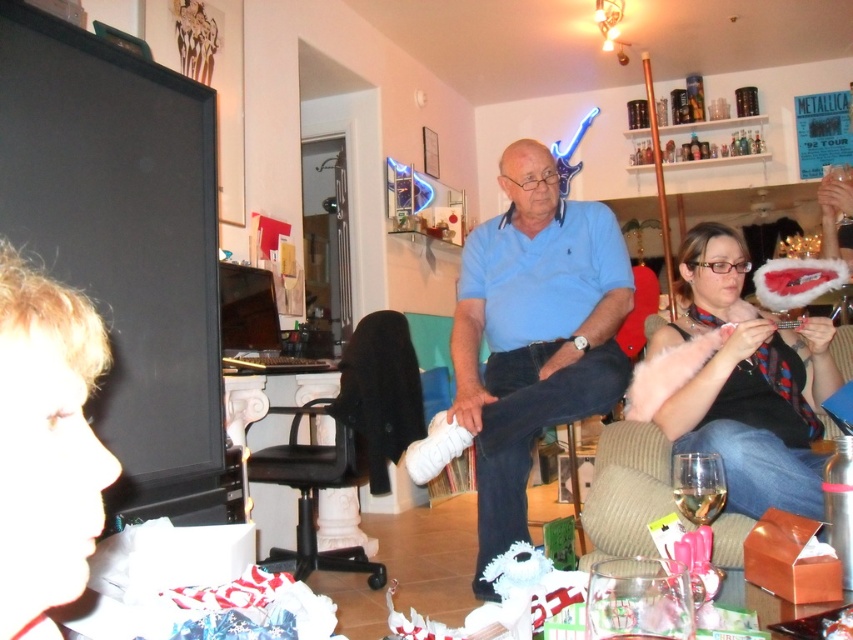
Question: Does black leather chair at center appear under brown fabric armchair at lower right?

Choices:
 (A) no
 (B) yes

Answer: (B)

Question: Is black leather chair at center closer to camera compared to brown fabric armchair at lower right?

Choices:
 (A) yes
 (B) no

Answer: (B)

Question: Is blue cotton shirt at center above black leather chair at center?

Choices:
 (A) no
 (B) yes

Answer: (B)

Question: Among these points, which one is farthest from the camera?

Choices:
 (A) (733, 461)
 (B) (611, 481)
 (C) (308, 502)

Answer: (C)

Question: Based on their relative distances, which object is farther from the brown fabric armchair at lower right?

Choices:
 (A) black leather chair at center
 (B) matte black purse at lower right
 (C) blue cotton shirt at center

Answer: (A)

Question: Which point is farther from the camera taking this photo?

Choices:
 (A) (x=618, y=369)
 (B) (x=733, y=234)

Answer: (B)